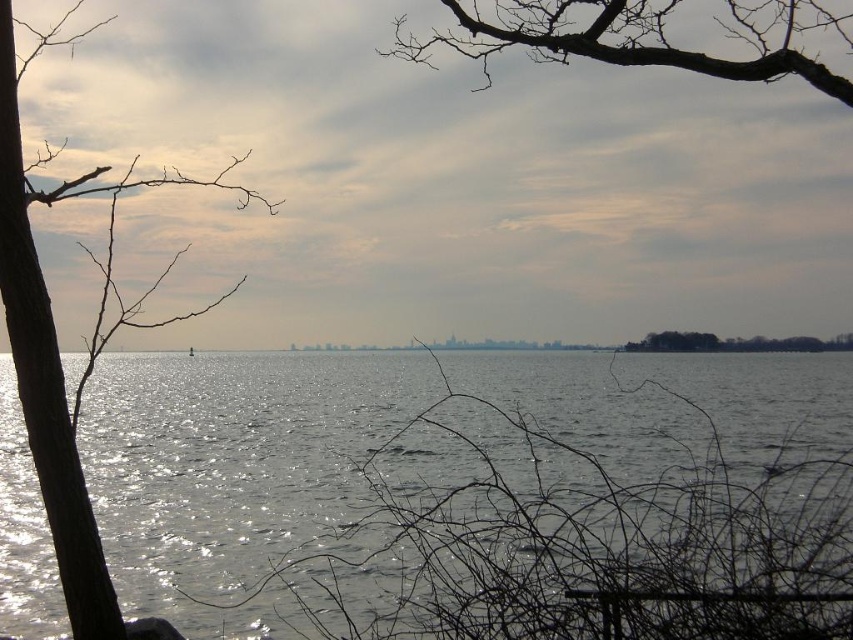
Question: Which point is farther from the camera taking this photo?

Choices:
 (A) (49, 324)
 (B) (697, 349)

Answer: (B)

Question: Estimate the real-world distances between objects in this image. Which object is farther from the glistening water at center?

Choices:
 (A) green leafy trees at right
 (B) brown/dry wood tree at left
 (C) bare branches at upper center

Answer: (A)

Question: Where is glistening water at center located in relation to green leafy trees at right in the image?

Choices:
 (A) below
 (B) above

Answer: (A)

Question: Does glistening water at center have a smaller size compared to green leafy trees at right?

Choices:
 (A) yes
 (B) no

Answer: (B)

Question: Can you confirm if bare branches at upper center is thinner than green leafy trees at right?

Choices:
 (A) no
 (B) yes

Answer: (A)

Question: Among these objects, which one is nearest to the camera?

Choices:
 (A) bare branches at upper center
 (B) brown/dry wood tree at left
 (C) glistening water at center
 (D) green leafy trees at right

Answer: (B)